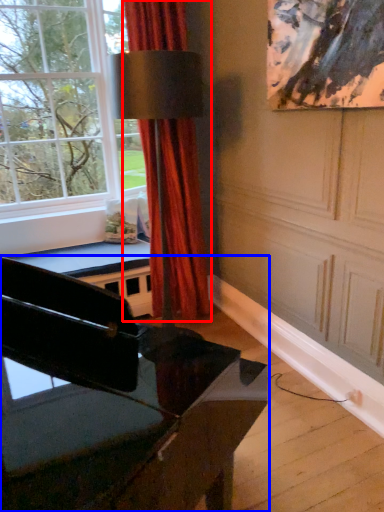
Question: Which object is further to the camera taking this photo, curtain (highlighted by a red box) or piano (highlighted by a blue box)?

Choices:
 (A) curtain
 (B) piano

Answer: (A)